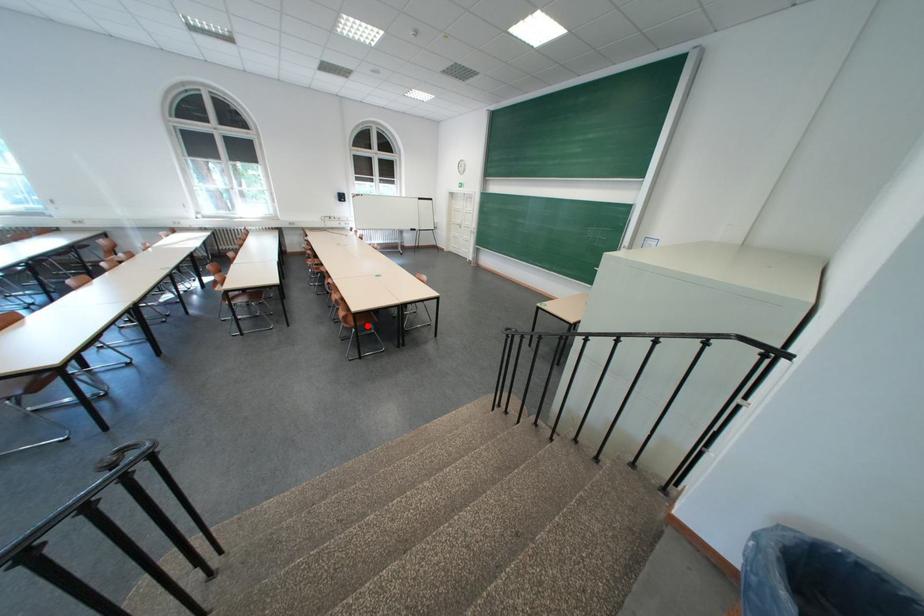
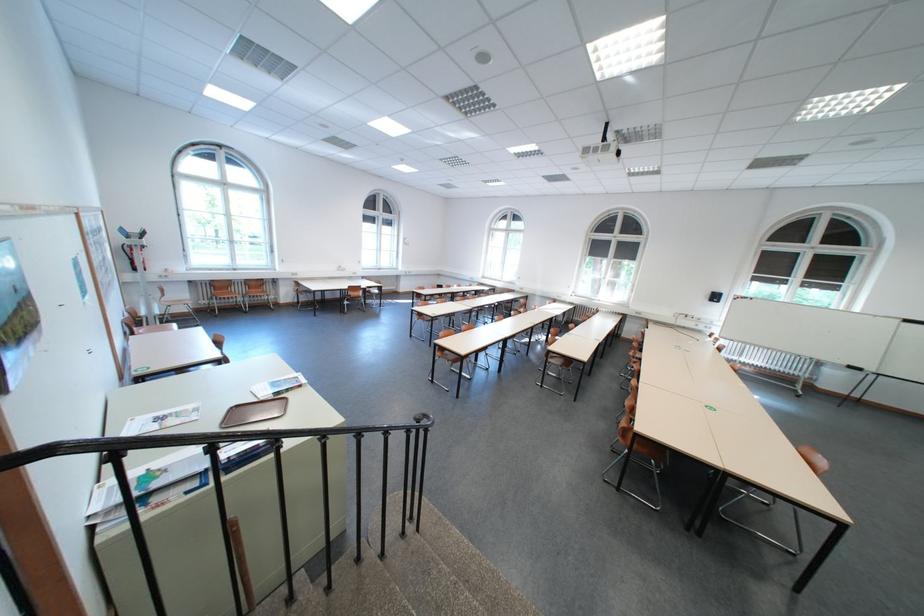
Locate, in the second image, the point that corresponds to the highlighted location in the first image.

(643, 445)